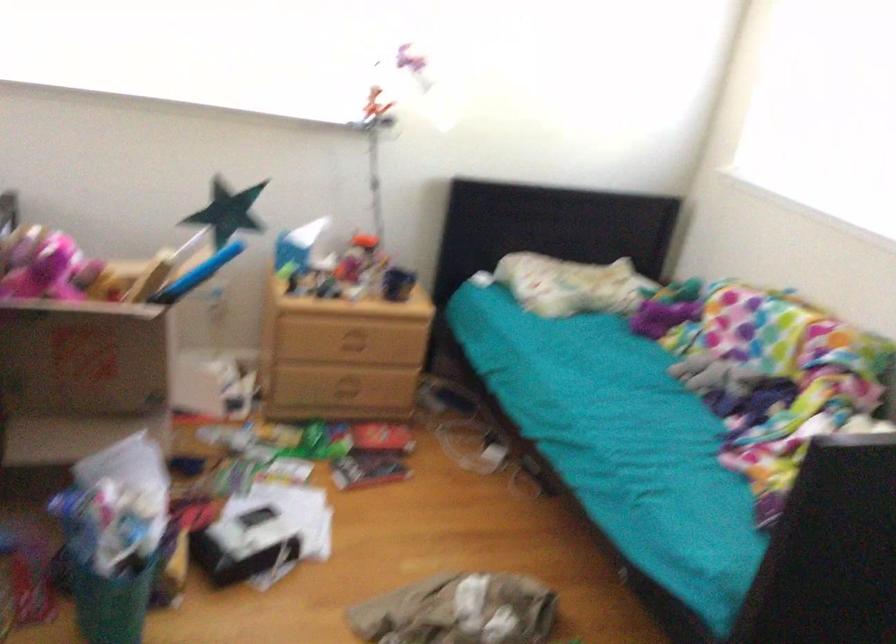
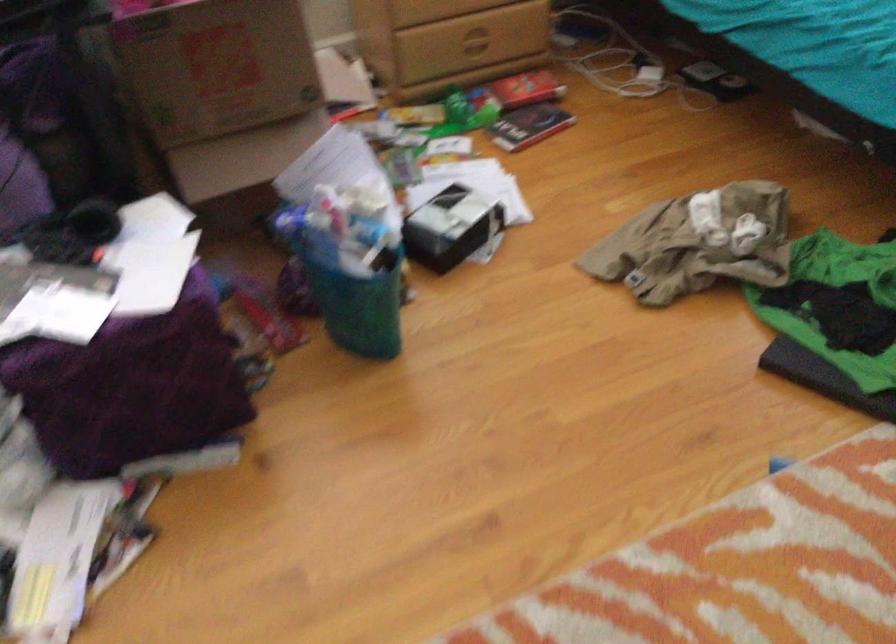
Find the pixel in the second image that matches (x=82, y=346) in the first image.

(216, 67)